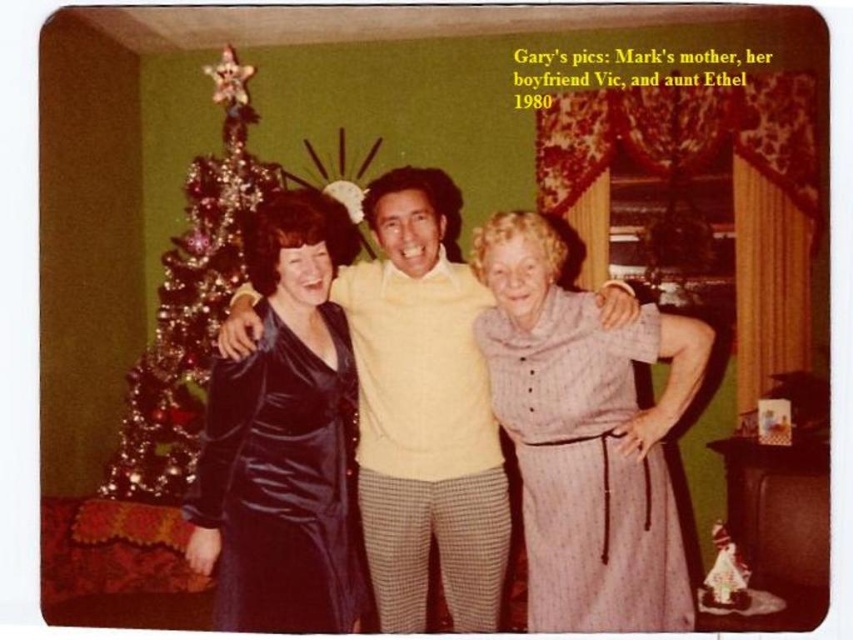
You are a photographer adjusting the camera settings to capture a group photo of the family. The subjects are wearing two dresses at the center of the scene. The striped fabric dress at center and the shiny purple dress at center. How far apart are these two dresses in inches?

The striped fabric dress at center is 24.91 inches from shiny purple dress at center.